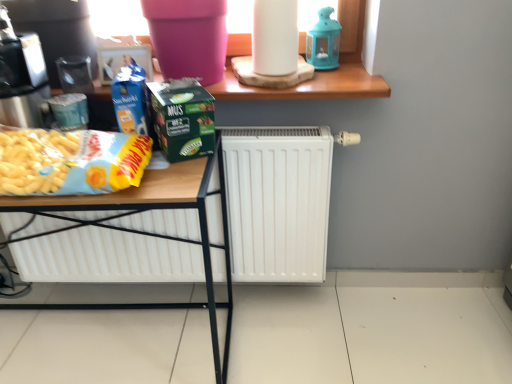
Image resolution: width=512 pixels, height=384 pixels. I want to click on free space to the right of white matte paper towel at upper center, so click(343, 83).